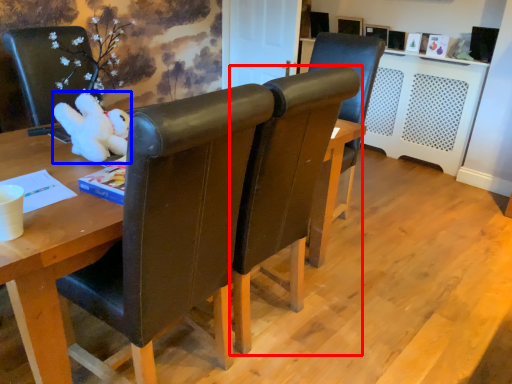
Question: Which object is further to the camera taking this photo, chair (highlighted by a red box) or toy (highlighted by a blue box)?

Choices:
 (A) chair
 (B) toy

Answer: (B)